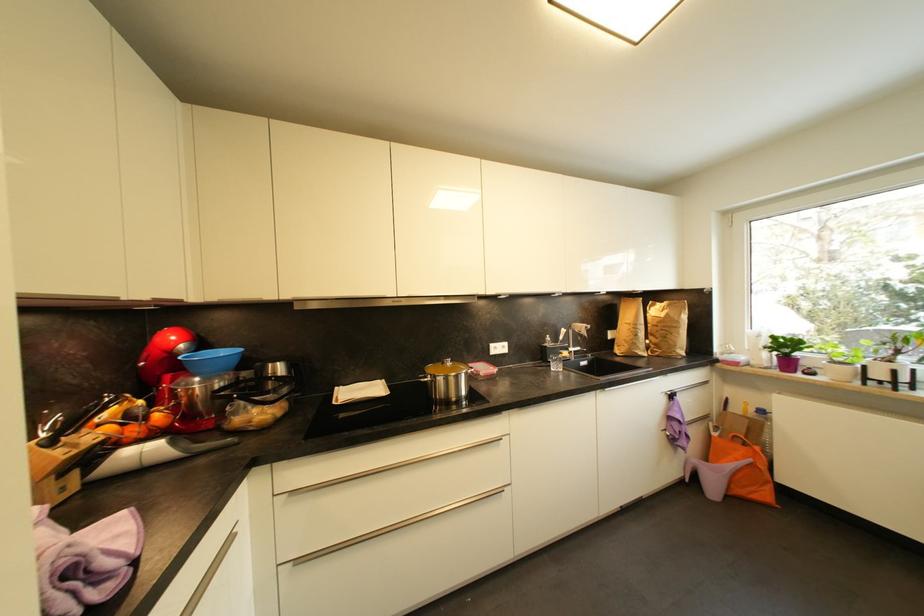
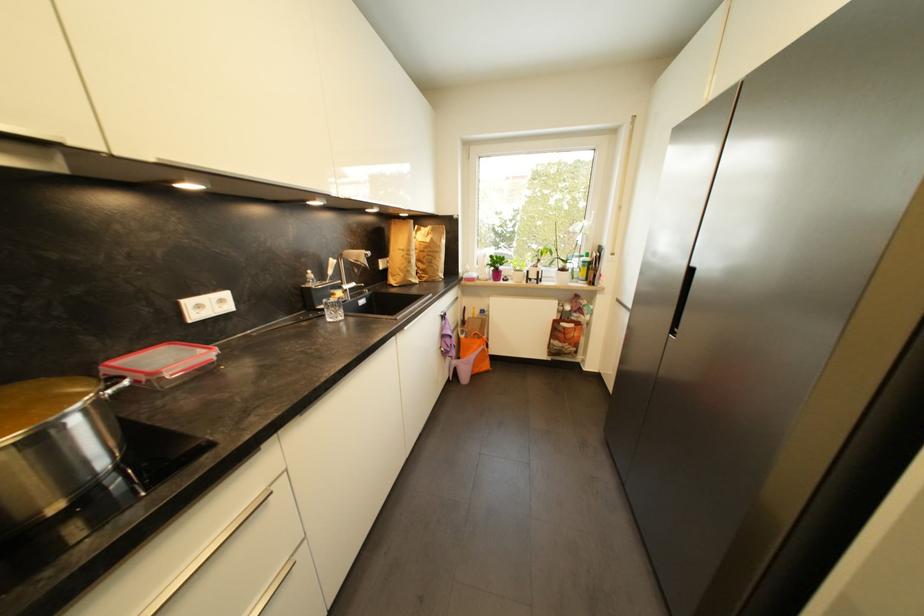
Find the pixel in the second image that matches the point at 578,349 in the first image.

(353, 285)